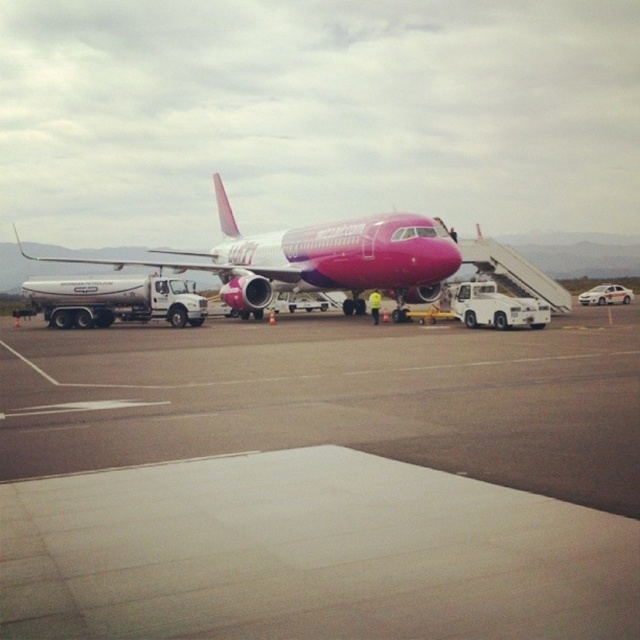
Question: Is smooth concrete tarmac at center thinner than white metallic fuel truck at left?

Choices:
 (A) no
 (B) yes

Answer: (A)

Question: Which object is farther from the camera taking this photo?

Choices:
 (A) white metallic fuel truck at left
 (B) smooth concrete tarmac at center
 (C) pink glossy airplane at center

Answer: (A)

Question: Does smooth concrete tarmac at center have a larger size compared to pink glossy airplane at center?

Choices:
 (A) no
 (B) yes

Answer: (A)

Question: Which object is farther from the camera taking this photo?

Choices:
 (A) pink glossy airplane at center
 (B) white metallic fuel truck at left
 (C) smooth concrete tarmac at center

Answer: (B)

Question: Among these objects, which one is farthest from the camera?

Choices:
 (A) white metallic fuel truck at left
 (B) smooth concrete tarmac at center
 (C) pink glossy airplane at center

Answer: (A)

Question: Can you confirm if pink glossy airplane at center is positioned below white metallic fuel truck at left?

Choices:
 (A) yes
 (B) no

Answer: (B)